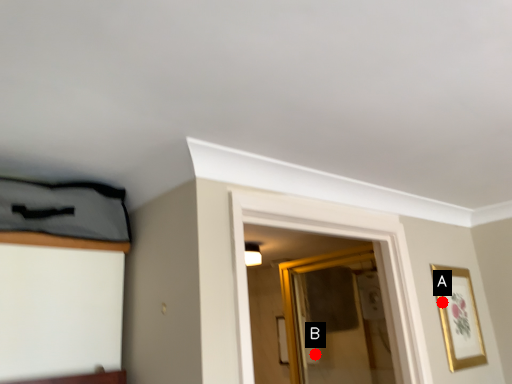
Question: Two points are circled on the image, labeled by A and B beside each circle. Which point appears closest to the camera in this image?

Choices:
 (A) A is closer
 (B) B is closer

Answer: (A)